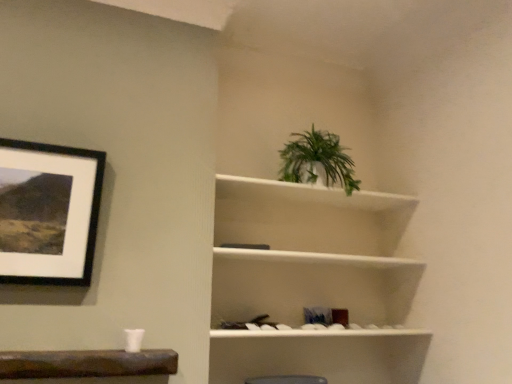
Question: From a real-world perspective, is white matte shelf at upper right physically located above or below black matte picture frame at upper left?

Choices:
 (A) above
 (B) below

Answer: (B)

Question: Would you say white matte shelf at upper right is inside or outside black matte picture frame at upper left?

Choices:
 (A) inside
 (B) outside

Answer: (B)

Question: Based on their relative distances, which object is nearer to the green leafy plant at upper center?

Choices:
 (A) white matte shelf at upper right
 (B) black matte picture frame at upper left

Answer: (A)

Question: Considering the real-world distances, which object is closest to the black matte picture frame at upper left?

Choices:
 (A) white matte shelf at upper right
 (B) green leafy plant at upper center

Answer: (A)